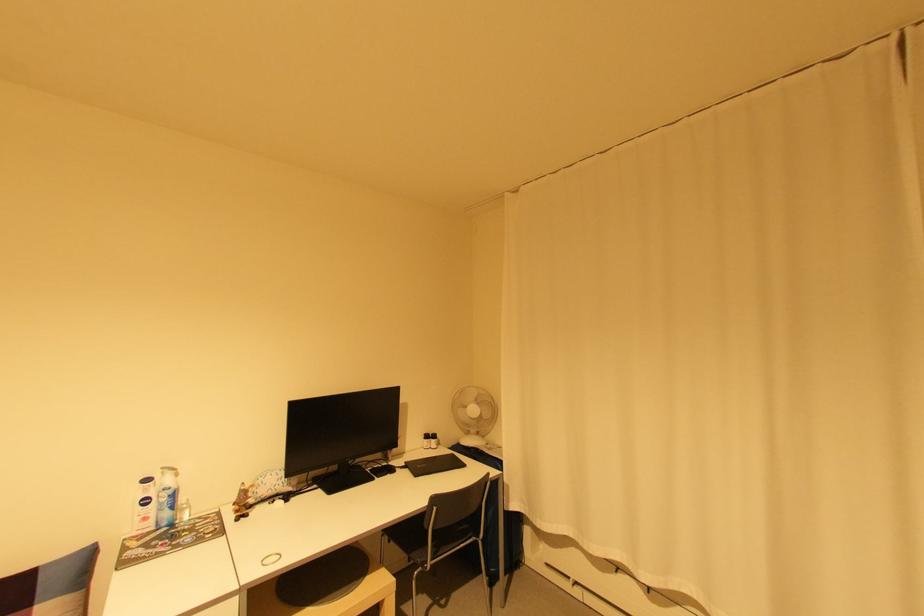
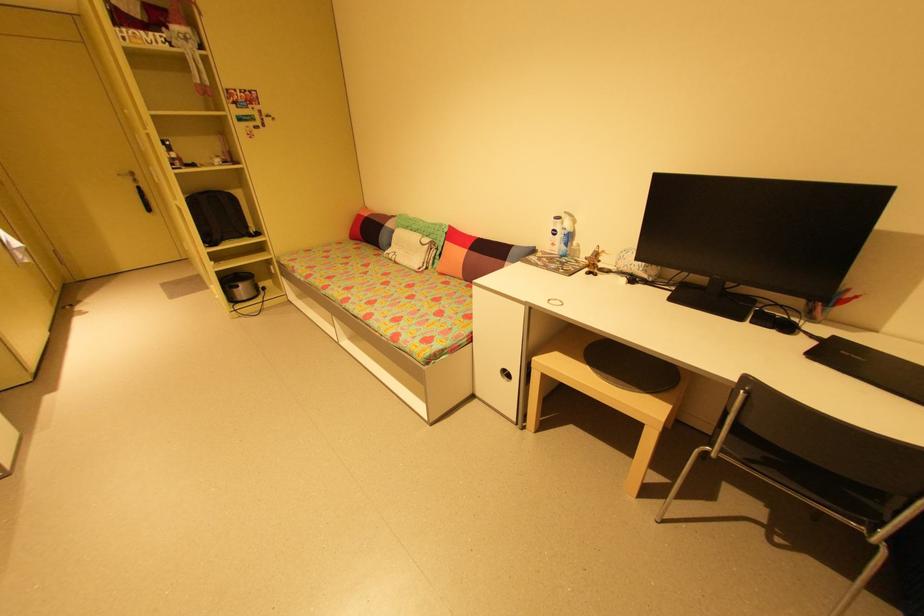
In the second image, find the point that corresponds to (475,535) in the first image.

(869, 519)